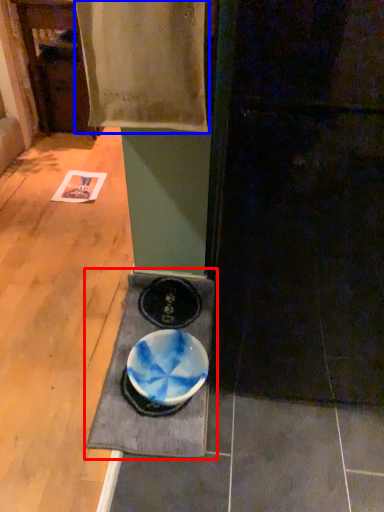
Question: Which of the following is the farthest to the observer, table (highlighted by a red box) or blanket (highlighted by a blue box)?

Choices:
 (A) table
 (B) blanket

Answer: (A)